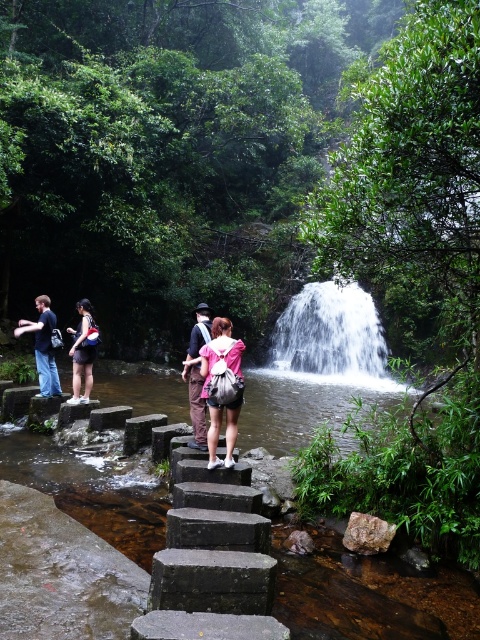
Question: Which of these objects is positioned closest to the matte pink backpack at center?

Choices:
 (A) white frothy water at center
 (B) dark blue jeans at left

Answer: (B)

Question: Which point is farther from the camera taking this photo?

Choices:
 (A) (259, 496)
 (B) (287, 316)
 (C) (216, 346)

Answer: (B)

Question: Which object is positioned closest to the dark blue jeans at left?

Choices:
 (A) white frothy water at center
 (B) pink fabric backpack at center
 (C) dark gray stone steps at center
 (D) matte pink backpack at center

Answer: (D)

Question: In this image, where is pink fabric backpack at center located relative to matte black backpack at center?

Choices:
 (A) below
 (B) above

Answer: (A)

Question: Is dark blue jeans at left to the right of matte pink backpack at center from the viewer's perspective?

Choices:
 (A) no
 (B) yes

Answer: (A)

Question: Can you confirm if white frothy water at center is positioned to the left of matte black backpack at center?

Choices:
 (A) no
 (B) yes

Answer: (A)